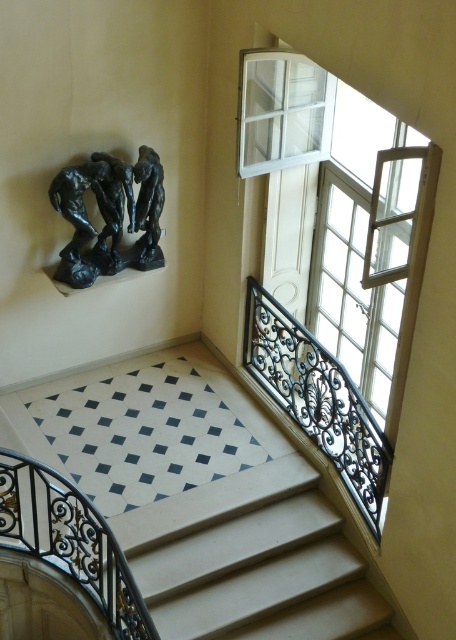
You are standing at the entrance of the staircase and want to place a small potted plant on the floor. The plant needs to be placed exactly at the position of the black wrought iron balustrade at lower left. What are the coordinates where you should place the plant?

The coordinates for the black wrought iron balustrade at lower left are at point (70, 540), so you should place the plant at those coordinates.

You are standing at the entrance of the historical building and see two points marked in the image. The first point is at coordinates point [407,339] and the second point is at point [291,340]. Which point is closer to you as you face the staircase?

Point [407,339] is in front of point [291,340], so it is closer to you as you face the staircase.

You are standing at the bottom of the staircase and looking upwards. You see the clear glass window at upper right and the black wrought iron balustrade at upper right. Which object is positioned to the right side when viewed from your perspective?

A: The clear glass window at upper right is to the right of the black wrought iron balustrade at upper right from your perspective.